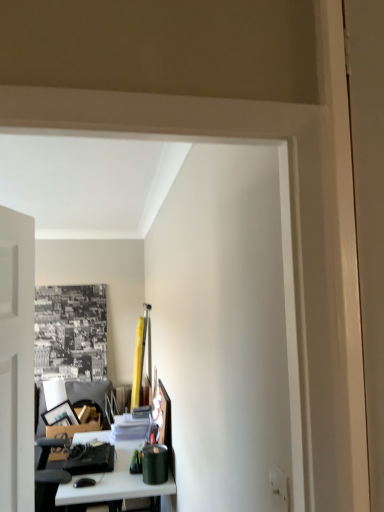
Question: Is matte black stationery at lower left, which is counted as the first stationery, starting from the back, looking in the opposite direction of white glossy table at lower left?

Choices:
 (A) no
 (B) yes

Answer: (A)

Question: Is matte black stationery at lower left, which is the 2th stationery in right-to-left order, not inside white glossy table at lower left?

Choices:
 (A) no
 (B) yes

Answer: (B)

Question: From a real-world perspective, is matte black stationery at lower left, arranged as the 1th stationery when viewed from the left, located higher than white glossy table at lower left?

Choices:
 (A) no
 (B) yes

Answer: (B)

Question: From the image's perspective, is matte black stationery at lower left, which is counted as the first stationery, starting from the back, over white glossy table at lower left?

Choices:
 (A) no
 (B) yes

Answer: (B)

Question: Is green matte canister at lower center, which is the second stationery from back to front, spatially inside white glossy table at lower left, or outside of it?

Choices:
 (A) inside
 (B) outside

Answer: (B)

Question: Is green matte canister at lower center, acting as the first stationery starting from the right, bigger or smaller than white glossy table at lower left?

Choices:
 (A) big
 (B) small

Answer: (B)

Question: Visually, is green matte canister at lower center, acting as the first stationery starting from the right, positioned to the left or to the right of white glossy table at lower left?

Choices:
 (A) left
 (B) right

Answer: (B)

Question: Is green matte canister at lower center, the first stationery from the front, wider or thinner than white glossy table at lower left?

Choices:
 (A) thin
 (B) wide

Answer: (A)

Question: Considering their positions, is matte black stationery at lower left, which is the 2th stationery in right-to-left order, located in front of or behind green matte canister at lower center, which is the second stationery from back to front?

Choices:
 (A) front
 (B) behind

Answer: (B)

Question: Is matte black stationery at lower left, which is counted as the first stationery, starting from the back, inside the boundaries of green matte canister at lower center, the first stationery from the front, or outside?

Choices:
 (A) outside
 (B) inside

Answer: (A)

Question: From their relative heights in the image, would you say matte black stationery at lower left, arranged as the 1th stationery when viewed from the left, is taller or shorter than green matte canister at lower center, acting as the first stationery starting from the right?

Choices:
 (A) tall
 (B) short

Answer: (B)

Question: From the image's perspective, is matte black stationery at lower left, which is counted as the first stationery, starting from the back, above or below green matte canister at lower center, the first stationery from the front?

Choices:
 (A) above
 (B) below

Answer: (B)

Question: From a real-world perspective, is white glossy table at lower left above or below green matte canister at lower center, acting as the 2th stationery starting from the left?

Choices:
 (A) above
 (B) below

Answer: (B)

Question: Is white glossy table at lower left inside the boundaries of green matte canister at lower center, the first stationery from the front, or outside?

Choices:
 (A) inside
 (B) outside

Answer: (B)